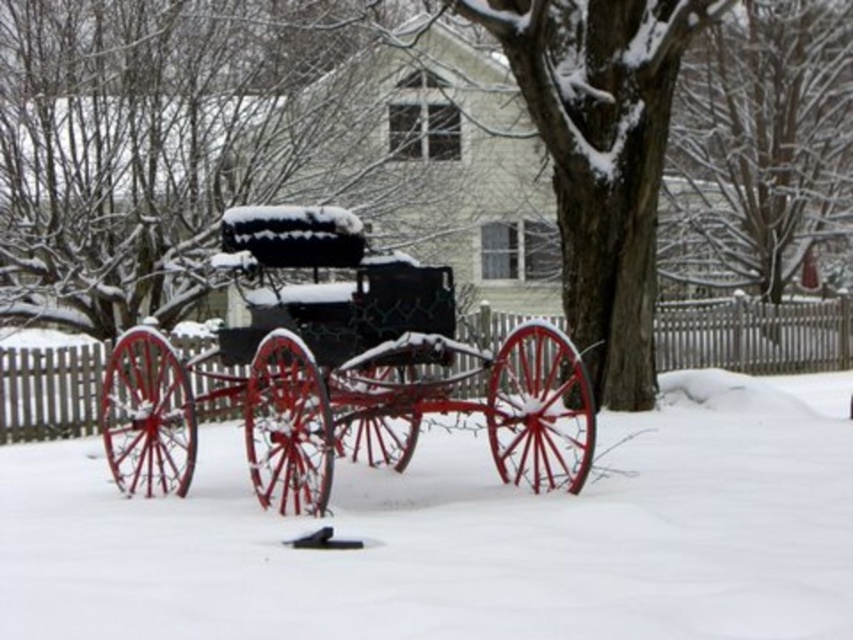
You are a delivery person who needs to deliver a package to the front of the metallic black carriage at center. The snow is 36.90 inches thick. Can you walk directly to the carriage without sinking into the white powdery snow at center?

The distance between the white powdery snow at center and the metallic black carriage at center is 36.90 inches. Since the snow is 36.90 inches thick, walking directly might cause you to sink into the white powdery snow at center.

You are standing at the origin point in the winter scene. There are two points marked in the image. Which point is closer to you, point (79,528) or point (527,422)?

Point (79,528) is in front of point (527,422), so it is closer to you.

You are standing at the point marked as point (463, 534). What is under your feet?

The white powdery snow at center is located at point (463, 534), so you are standing on the white powdery snow at center.